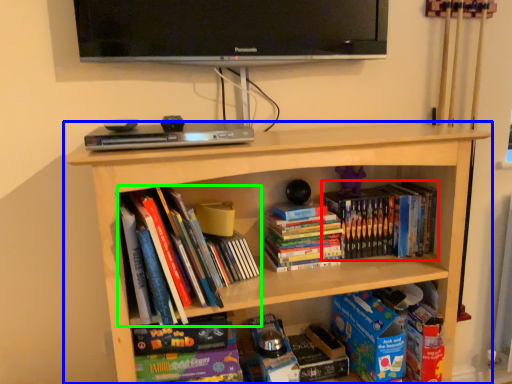
Question: Which object is the farthest from book (highlighted by a red box)? Choose among these: bookcase (highlighted by a blue box) or book (highlighted by a green box).

Choices:
 (A) bookcase
 (B) book

Answer: (B)